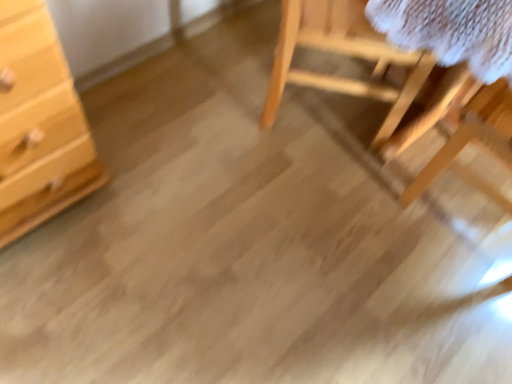
Question: Is wooden table at right thinner than light wood chest of drawers at left?

Choices:
 (A) yes
 (B) no

Answer: (B)

Question: Does wooden table at right have a larger size compared to light wood chest of drawers at left?

Choices:
 (A) yes
 (B) no

Answer: (A)

Question: Does wooden table at right come in front of light wood chest of drawers at left?

Choices:
 (A) no
 (B) yes

Answer: (A)

Question: Are wooden table at right and light wood chest of drawers at left far apart?

Choices:
 (A) no
 (B) yes

Answer: (A)

Question: Can you confirm if wooden table at right is taller than light wood chest of drawers at left?

Choices:
 (A) no
 (B) yes

Answer: (A)

Question: Choose the correct answer: Is wooden table at right inside light wood chest of drawers at left or outside it?

Choices:
 (A) inside
 (B) outside

Answer: (B)

Question: Does point (489, 1) appear closer or farther from the camera than point (20, 192)?

Choices:
 (A) farther
 (B) closer

Answer: (B)

Question: Considering their positions, is wooden table at right located in front of or behind light wood chest of drawers at left?

Choices:
 (A) behind
 (B) front

Answer: (A)

Question: From a real-world perspective, is wooden table at right above or below light wood chest of drawers at left?

Choices:
 (A) above
 (B) below

Answer: (B)

Question: From a real-world perspective, is natural wood chair at upper right above or below light wood chest of drawers at left?

Choices:
 (A) below
 (B) above

Answer: (A)

Question: Does point (465, 76) appear closer or farther from the camera than point (5, 213)?

Choices:
 (A) farther
 (B) closer

Answer: (A)

Question: Is natural wood chair at upper right wider or thinner than light wood chest of drawers at left?

Choices:
 (A) wide
 (B) thin

Answer: (A)

Question: In terms of height, does natural wood chair at upper right look taller or shorter compared to light wood chest of drawers at left?

Choices:
 (A) short
 (B) tall

Answer: (A)

Question: Considering their positions, is light wood chest of drawers at left located in front of or behind natural wood chair at upper right?

Choices:
 (A) front
 (B) behind

Answer: (A)

Question: Does point pyautogui.click(x=33, y=29) appear closer or farther from the camera than point pyautogui.click(x=325, y=18)?

Choices:
 (A) farther
 (B) closer

Answer: (B)